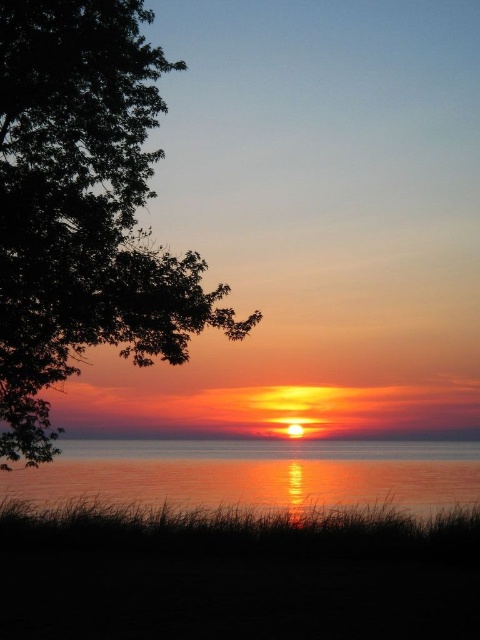
Between green leafy tree at left and smooth glass water at center, which one is positioned higher?

green leafy tree at left

What do you see at coordinates (83, 211) in the screenshot? I see `green leafy tree at left` at bounding box center [83, 211].

Find the location of a particular element. The width and height of the screenshot is (480, 640). green leafy tree at left is located at coordinates (83, 211).